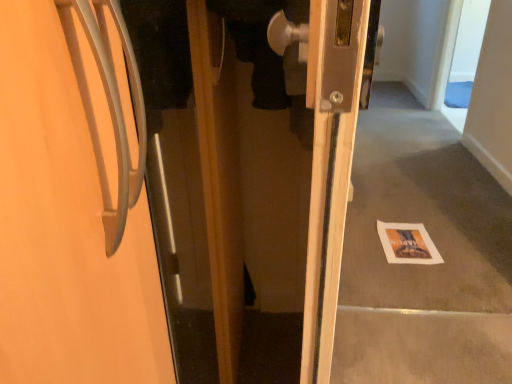
Measure the distance between point (59, 112) and camera.

The depth of point (59, 112) is 8.70 inches.

This screenshot has width=512, height=384. Describe the element at coordinates (67, 223) in the screenshot. I see `matte silver door at center` at that location.

Locate an element on the screen. The image size is (512, 384). matte silver door at center is located at coordinates (67, 223).

The height and width of the screenshot is (384, 512). What are the coordinates of `white paper at lower right` in the screenshot? It's located at (407, 244).

What do you see at coordinates (407, 244) in the screenshot?
I see `white paper at lower right` at bounding box center [407, 244].

Where is `matte silver door at center`? matte silver door at center is located at coordinates (67, 223).

Consider the image. Is matte silver door at center to the left of white paper at lower right from the viewer's perspective?

Yes.

From the picture: Is the position of matte silver door at center more distant than that of white paper at lower right?

No, matte silver door at center is closer to the viewer.

Considering the positions of point (42, 98) and point (431, 261), is point (42, 98) closer or farther from the camera than point (431, 261)?

Clearly, point (42, 98) is closer to the camera than point (431, 261).

From the image's perspective, which object appears higher, matte silver door at center or white paper at lower right?

matte silver door at center.

From a real-world perspective, between matte silver door at center and white paper at lower right, who is vertically higher?

matte silver door at center.

Between matte silver door at center and white paper at lower right, which one has smaller width?

white paper at lower right is thinner.

Looking at this image, between matte silver door at center and white paper at lower right, which one has less height?

white paper at lower right is shorter.

Looking at the image, does matte silver door at center seem bigger or smaller compared to white paper at lower right?

Considering their sizes, matte silver door at center takes up more space than white paper at lower right.

Is matte silver door at center positioned beyond the bounds of white paper at lower right?

Yes, matte silver door at center is not within white paper at lower right.

Consider the image. Is matte silver door at center positioned far away from white paper at lower right?

matte silver door at center is positioned a significant distance from white paper at lower right.

Is matte silver door at center looking in the opposite direction of white paper at lower right?

No.

Can you tell me how much matte silver door at center and white paper at lower right differ in facing direction?

The facing directions of matte silver door at center and white paper at lower right are 88.6 degrees apart.

I want to click on postcard below the matte silver door at center (from a real-world perspective), so click(x=407, y=244).

Which object is positioned more to the right, white paper at lower right or matte silver door at center?

From the viewer's perspective, white paper at lower right appears more on the right side.

Which is behind, white paper at lower right or matte silver door at center?

white paper at lower right.

Between point (418, 231) and point (42, 188), which one is positioned behind?

Point (418, 231)

From the image's perspective, is white paper at lower right located above or below matte silver door at center?

Based on their image positions, white paper at lower right is located beneath matte silver door at center.

From a real-world perspective, which is physically below, white paper at lower right or matte silver door at center?

In real-world perspective, white paper at lower right is lower.

Is white paper at lower right thinner than matte silver door at center?

Yes.

Which of these two, white paper at lower right or matte silver door at center, stands taller?

With more height is matte silver door at center.

In terms of size, does white paper at lower right appear bigger or smaller than matte silver door at center?

In the image, white paper at lower right appears to be smaller than matte silver door at center.

Would you say white paper at lower right is inside or outside matte silver door at center?

white paper at lower right is not enclosed by matte silver door at center.

Is white paper at lower right next to matte silver door at center?

No, white paper at lower right is not making contact with matte silver door at center.

Is white paper at lower right facing away from matte silver door at center?

No, white paper at lower right is not facing the opposite direction of matte silver door at center.

How many degrees apart are the facing directions of white paper at lower right and matte silver door at center?

There is a 88.6-degree angle between the facing directions of white paper at lower right and matte silver door at center.

Identify the location of postcard directly beneath the matte silver door at center (from a real-world perspective). Image resolution: width=512 pixels, height=384 pixels. (407, 244).

Identify the location of postcard beneath the matte silver door at center (from a real-world perspective). (407, 244).

Image resolution: width=512 pixels, height=384 pixels. In the image, there is a matte silver door at center. In order to click on postcard below it (from the image's perspective) in this screenshot , I will do `click(407, 244)`.